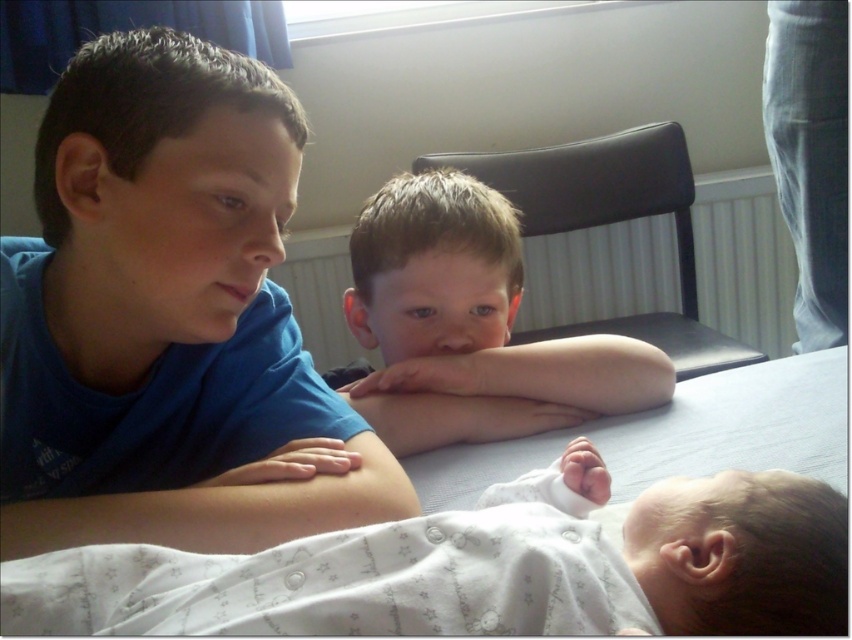
Looking at this image, you are standing in the scene and want to place a small toy between the two points labeled point (786, 579) and point (612, 413). Which point should the toy be closer to so it is in front of both points?

The toy should be placed closer to point (786, 579) because it is in front of point (612, 413).